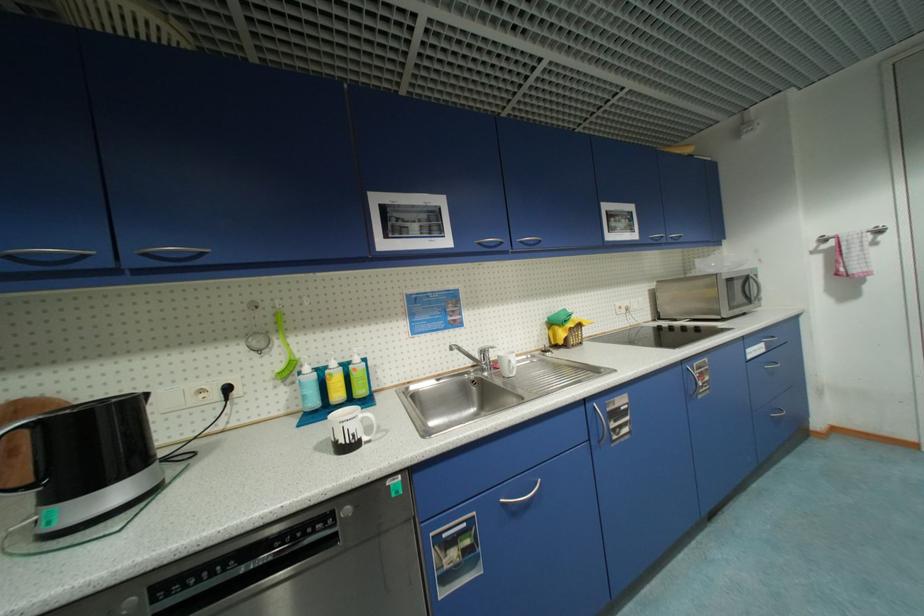
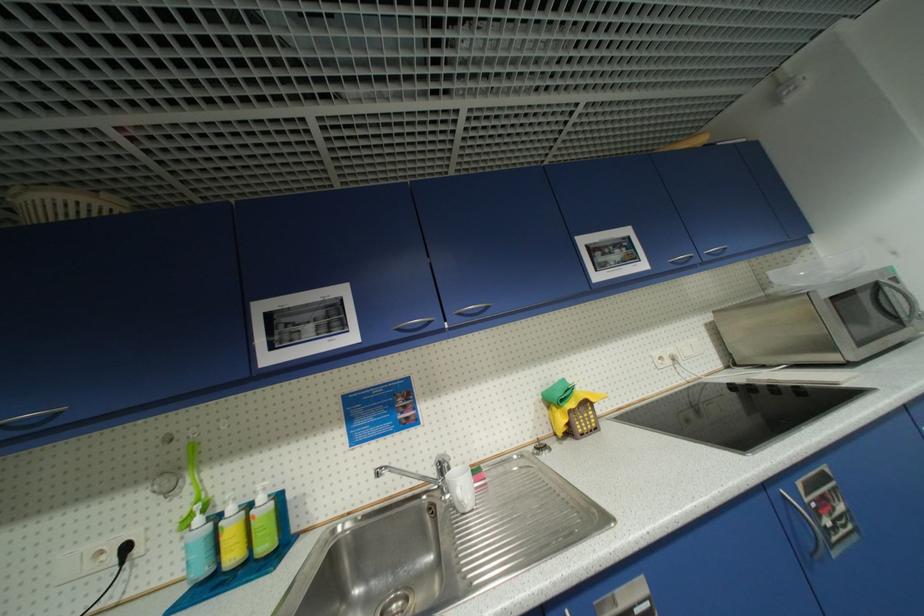
The images are taken continuously from a first-person perspective. In which direction are you moving?

The cameraman walked toward right, forward.